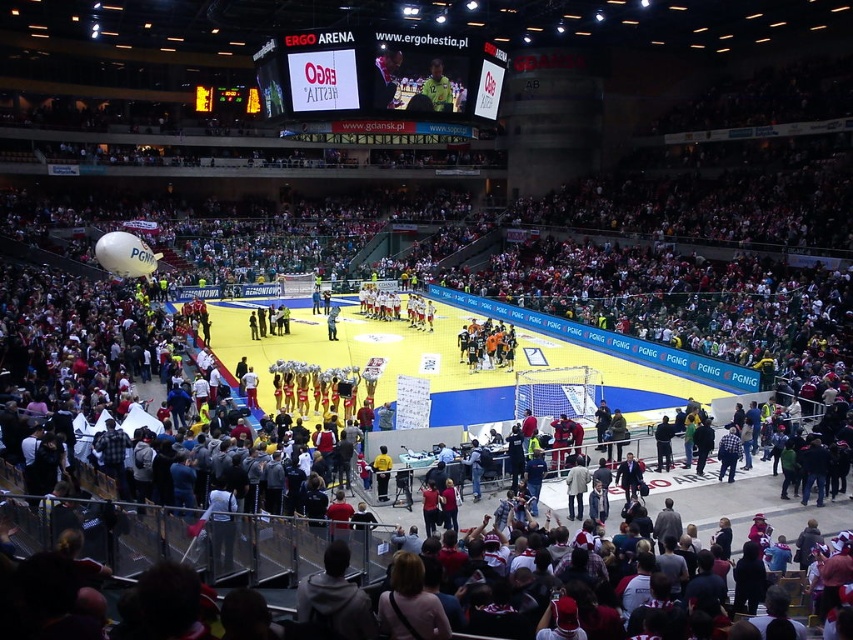
Question: Which point is closer to the camera?

Choices:
 (A) yellow synthetic turf at center
 (B) white glossy scoreboard at upper center
 (C) orange jersey at center
 (D) yellow-green jersey at upper center

Answer: (B)

Question: Which point appears farthest from the camera in this image?

Choices:
 (A) (447, 58)
 (B) (434, 70)
 (C) (271, 339)
 (D) (509, 342)

Answer: (C)

Question: Can you confirm if white glossy scoreboard at upper center is positioned below orange jersey at center?

Choices:
 (A) yes
 (B) no

Answer: (B)

Question: Can you confirm if yellow synthetic turf at center is positioned to the right of orange jersey at center?

Choices:
 (A) yes
 (B) no

Answer: (B)

Question: Which object appears farthest from the camera in this image?

Choices:
 (A) white glossy scoreboard at upper center
 (B) yellow synthetic turf at center
 (C) orange jersey at center

Answer: (C)

Question: Is orange jersey at center behind yellow-green jersey at upper center?

Choices:
 (A) no
 (B) yes

Answer: (B)